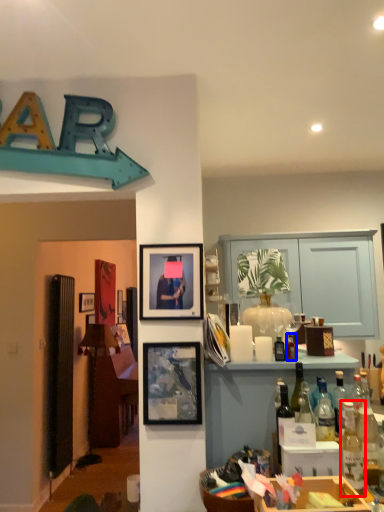
Question: Which point is closer to the camera, bottle (highlighted by a red box) or bottle (highlighted by a blue box)?

Choices:
 (A) bottle
 (B) bottle

Answer: (A)